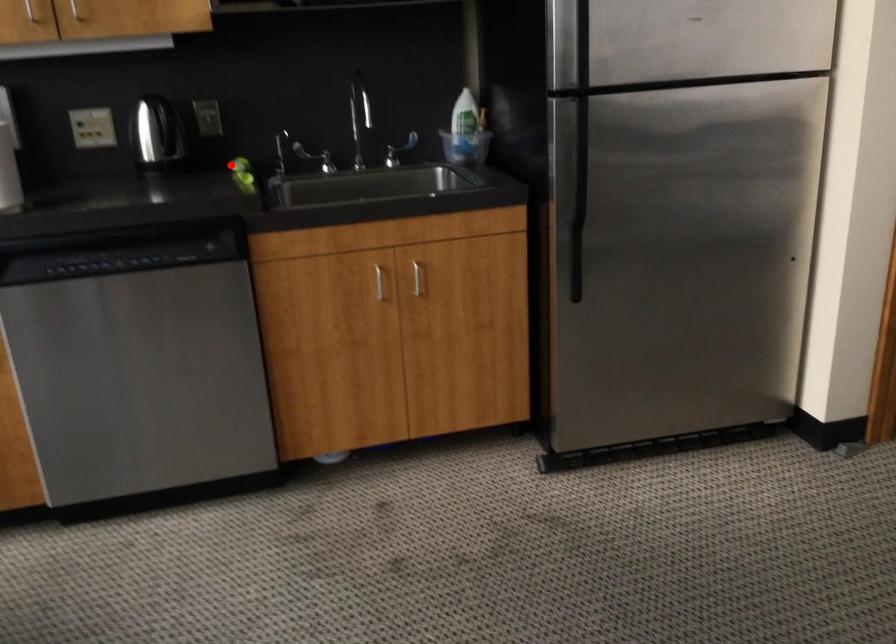
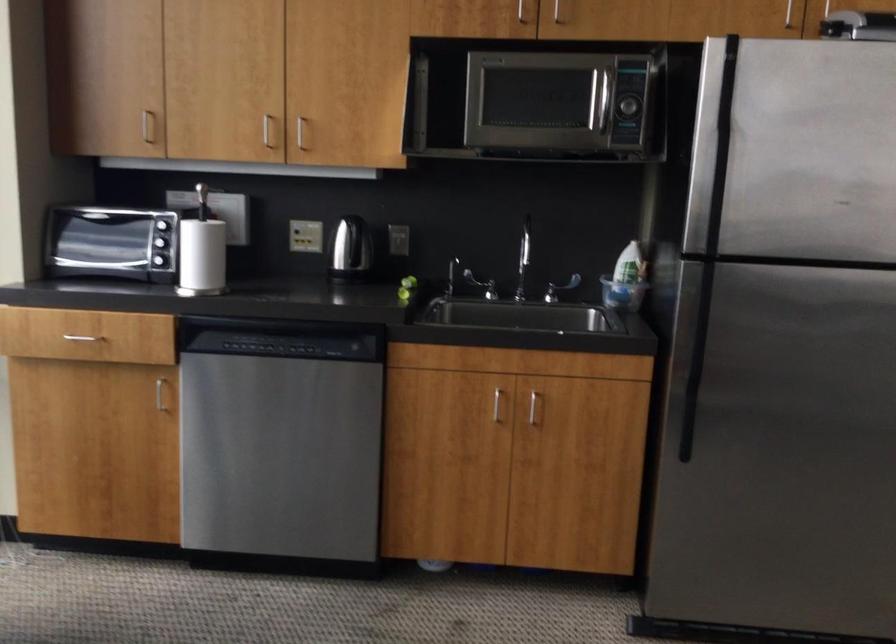
Locate, in the second image, the point that corresponds to the highlighted location in the first image.

(409, 281)